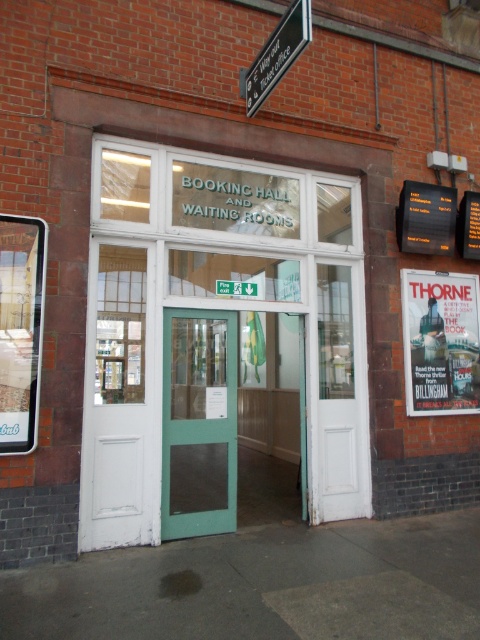
Can you confirm if matte paper poster at right is positioned to the right of metallic sign at upper center?

Correct, you'll find matte paper poster at right to the right of metallic sign at upper center.

Does matte paper poster at right have a smaller size compared to metallic sign at upper center?

Incorrect, matte paper poster at right is not smaller in size than metallic sign at upper center.

At what (x,y) coordinates should I click in order to perform the action: click on matte paper poster at right. Please return your answer as a coordinate pair (x, y). Looking at the image, I should click on (441, 340).

The height and width of the screenshot is (640, 480). In order to click on matte paper poster at right in this screenshot , I will do `click(441, 340)`.

Which is in front, point (155, 436) or point (193, 417)?

Point (155, 436) is in front.

Measure the distance between white wooden door at left and green matte door at center.

A distance of 43.21 centimeters exists between white wooden door at left and green matte door at center.

Which is behind, point (156, 419) or point (231, 326)?

Point (231, 326)

Find the location of a particular element. white wooden door at left is located at coordinates (119, 397).

Between point (210, 496) and point (445, 378), which one is positioned in front?

Point (210, 496) is more forward.

Is white wooden door at center taller than matte paper poster at right?

Correct, white wooden door at center is much taller as matte paper poster at right.

Does point (349, 467) lie in front of point (408, 348)?

Yes, point (349, 467) is in front of point (408, 348).

Image resolution: width=480 pixels, height=640 pixels. I want to click on white wooden door at center, so click(x=217, y=340).